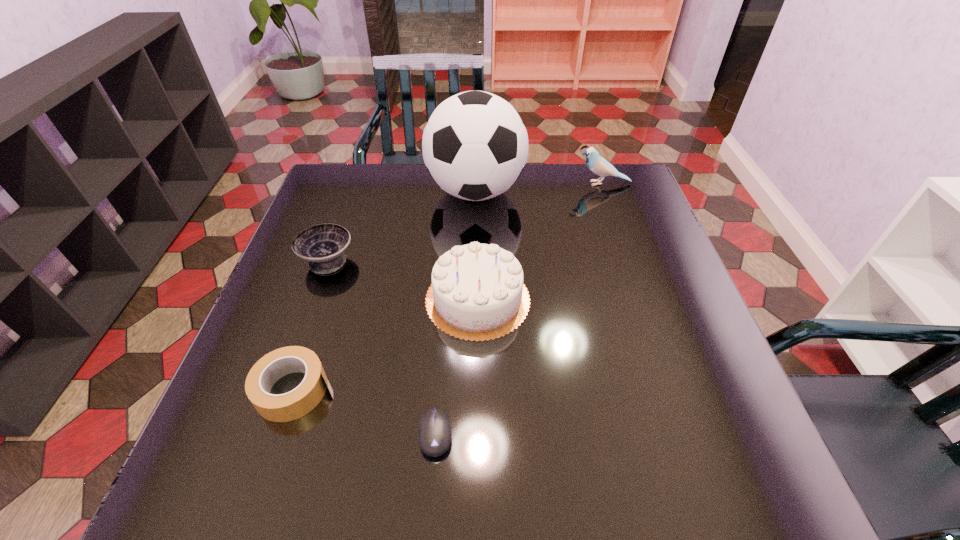
Identify the location of free location located at the face of the rightmost object. Image resolution: width=960 pixels, height=540 pixels. (445, 184).

Where is `free spot located 0.080m on the right of the third shortest object`? free spot located 0.080m on the right of the third shortest object is located at coordinates (386, 260).

This screenshot has height=540, width=960. I want to click on vacant area situated 0.360m at the edge of the second shortest object, so click(x=516, y=390).

This screenshot has height=540, width=960. I want to click on free space located 0.240m on the left of the computer mouse, so click(x=286, y=434).

Find the location of a particular element. soccer ball at the far edge is located at coordinates (475, 145).

This screenshot has height=540, width=960. In order to click on bird that is at the far edge in this screenshot , I will do `click(598, 165)`.

Identify the location of object that is at the near edge. (434, 433).

Identify the location of bowl that is at the left edge. The width and height of the screenshot is (960, 540). (323, 245).

Identify the location of duct tape that is at the left edge. The image size is (960, 540). (298, 402).

Identify the location of object that is at the right edge. (598, 165).